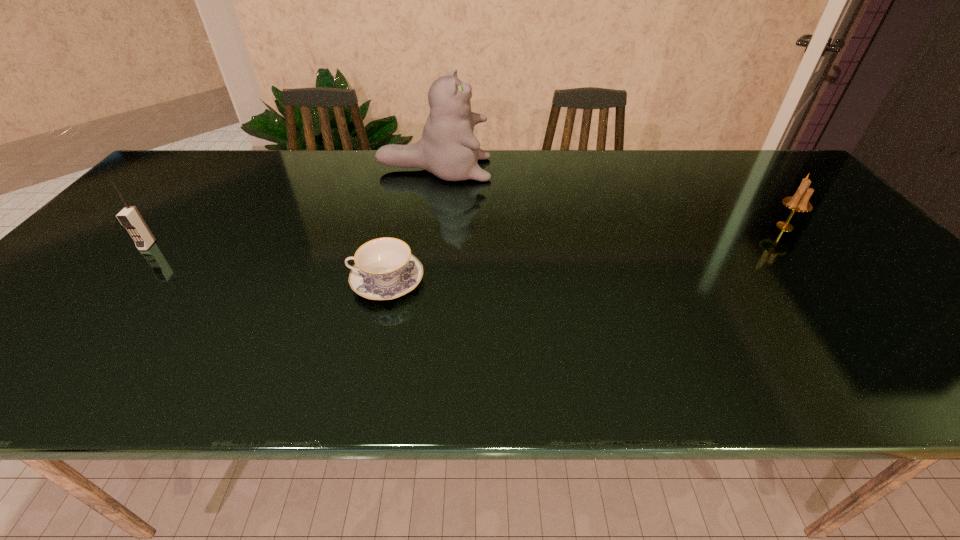
Find the location of a particular element. Image resolution: width=960 pixels, height=540 pixels. vacant space located on the left of the rightmost object is located at coordinates (630, 226).

The image size is (960, 540). What are the coordinates of `blank space located 0.200m with the handle on the side of the nearest object` in the screenshot? It's located at pos(263,281).

Where is `vacant space located with the handle on the side of the nearest object`? Image resolution: width=960 pixels, height=540 pixels. vacant space located with the handle on the side of the nearest object is located at coordinates (298, 281).

Locate an element on the screen. free region located 0.140m with the handle on the side of the nearest object is located at coordinates (289, 281).

You are a GUI agent. You are given a task and a screenshot of the screen. Output one action in this format:
    pyautogui.click(x=<x>, y=<y>)
    Task: Click on the object located in the far edge section of the desktop
    
    Given the screenshot: What is the action you would take?
    pyautogui.click(x=448, y=148)

Where is `object present at the left edge`? object present at the left edge is located at coordinates (129, 217).

Locate an element on the screen. This screenshot has height=540, width=960. object present at the right edge is located at coordinates (798, 202).

Locate an element on the screen. This screenshot has height=540, width=960. vacant area at the far edge of the desktop is located at coordinates (603, 162).

Identify the location of vacant space at the left edge of the desktop. (112, 282).

The height and width of the screenshot is (540, 960). In order to click on free region at the right edge of the desktop in this screenshot , I will do `click(907, 284)`.